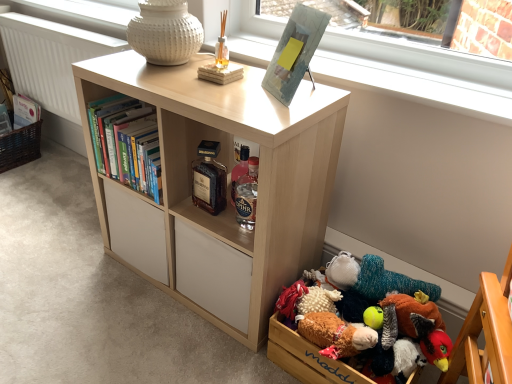
You are a GUI agent. You are given a task and a screenshot of the screen. Output one action in this format:
    pyautogui.click(x=<x>, y=<y>)
    Task: Click on the vacant area in front of light wood bookcase at center
    
    Given the screenshot: What is the action you would take?
    pyautogui.click(x=161, y=345)